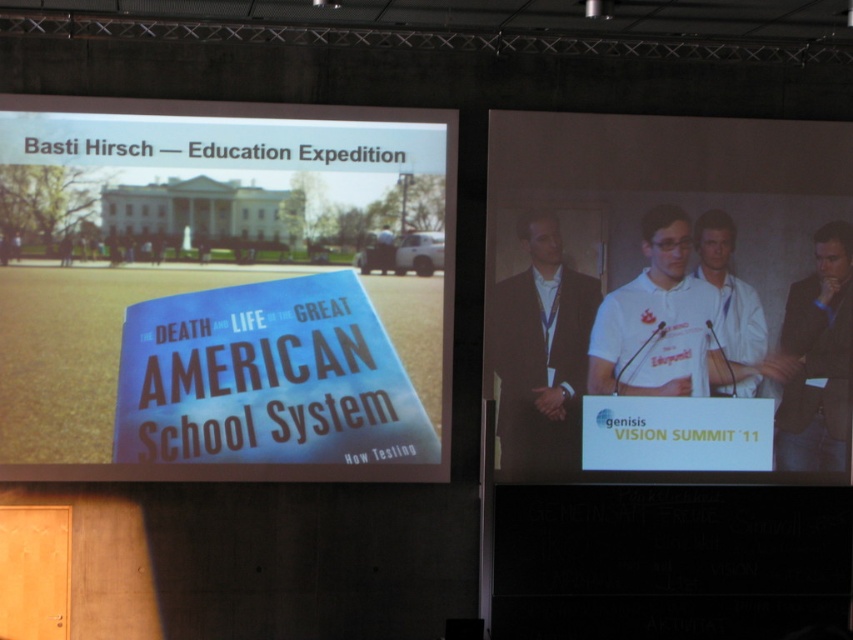
Question: Which object is farther from the camera taking this photo?

Choices:
 (A) blue paper sign at upper left
 (B) white glossy podium at center
 (C) dark brown suit at center

Answer: (C)

Question: Where is blue paper sign at upper left located in relation to black leather jacket at right in the image?

Choices:
 (A) left
 (B) right

Answer: (A)

Question: Does white glossy podium at center appear on the right side of black leather jacket at right?

Choices:
 (A) yes
 (B) no

Answer: (B)

Question: Does blue paper sign at upper left come behind black leather jacket at right?

Choices:
 (A) yes
 (B) no

Answer: (B)

Question: Among these points, which one is nearest to the camera?

Choices:
 (A) [x=554, y=404]
 (B) [x=834, y=396]
 (C) [x=764, y=468]

Answer: (A)

Question: Based on their relative distances, which object is farther from the black leather jacket at right?

Choices:
 (A) white glossy podium at center
 (B) blue paper sign at upper left

Answer: (B)